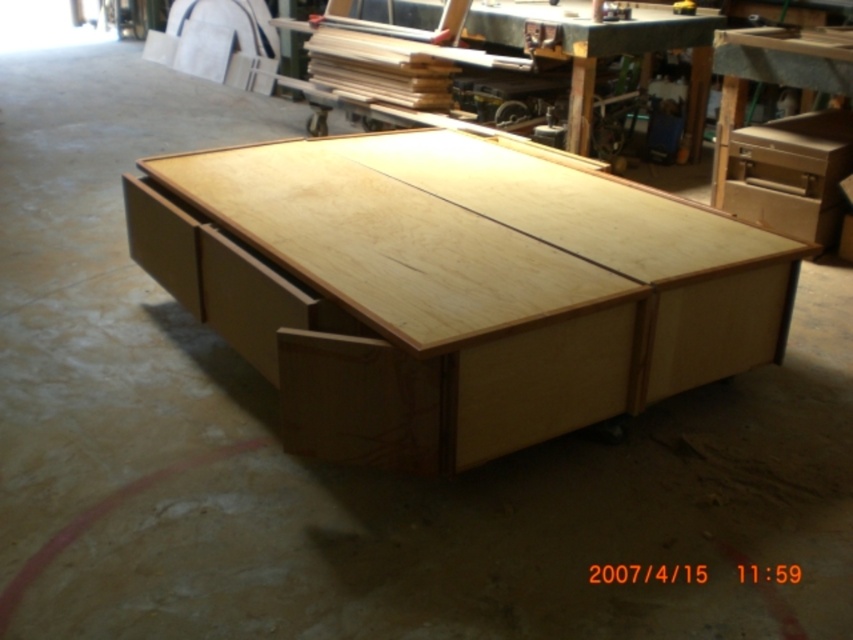
Question: Which object is closer to the camera taking this photo?

Choices:
 (A) natural wood drawer at center
 (B) natural wood table at center

Answer: (B)

Question: Can you confirm if natural wood table at center is wider than natural wood drawer at center?

Choices:
 (A) yes
 (B) no

Answer: (A)

Question: Can you confirm if natural wood table at center is positioned to the left of natural wood drawer at center?

Choices:
 (A) no
 (B) yes

Answer: (B)

Question: Among these points, which one is farthest from the camera?

Choices:
 (A) (738, 269)
 (B) (769, 180)

Answer: (B)

Question: From the image, what is the correct spatial relationship of natural wood table at center in relation to natural wood drawer at center?

Choices:
 (A) right
 (B) left

Answer: (B)

Question: Among these objects, which one is nearest to the camera?

Choices:
 (A) natural wood drawer at center
 (B) natural wood table at center

Answer: (B)